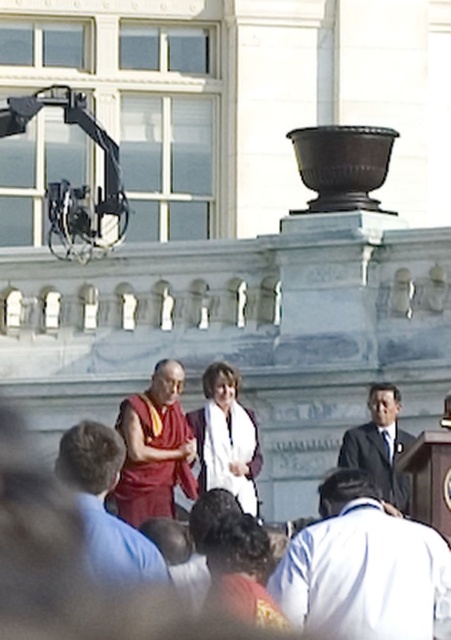
Is white cotton shirt at center above dark suit at center?

Incorrect, white cotton shirt at center is not positioned above dark suit at center.

Is white cotton shirt at center in front of dark suit at center?

Yes, it is.

Does point (427, 417) come behind point (380, 465)?

Yes.

This screenshot has height=640, width=451. In order to click on white cotton shirt at center in this screenshot , I will do `click(322, 420)`.

Is point (119, 568) closer to viewer compared to point (378, 385)?

Yes, point (119, 568) is in front of point (378, 385).

This screenshot has height=640, width=451. I want to click on matte red robe at center, so click(105, 506).

Is white cotton shirt at lower center bigger than dark suit at center?

No.

Between white cotton shirt at lower center and dark suit at center, which one appears on the right side from the viewer's perspective?

dark suit at center is more to the right.

Identify the location of white cotton shirt at lower center. (363, 568).

You are a GUI agent. You are given a task and a screenshot of the screen. Output one action in this format:
    pyautogui.click(x=<x>, y=<y>)
    Task: Click on the white cotton shirt at lower center
    This screenshot has height=640, width=451.
    Given the screenshot: What is the action you would take?
    pyautogui.click(x=363, y=568)